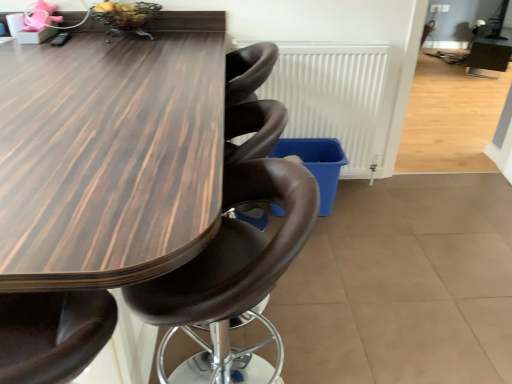
Question: Is white matte radiator at center inside or outside of wooden table at center?

Choices:
 (A) outside
 (B) inside

Answer: (A)

Question: In terms of height, does white matte radiator at center look taller or shorter compared to wooden table at center?

Choices:
 (A) tall
 (B) short

Answer: (B)

Question: Estimate the real-world distances between objects in this image. Which object is farther from the wooden table at center?

Choices:
 (A) brown leather chair at center
 (B) white matte radiator at center

Answer: (B)

Question: Estimate the real-world distances between objects in this image. Which object is closer to the wooden table at center?

Choices:
 (A) brown leather chair at center
 (B) white matte radiator at center

Answer: (A)